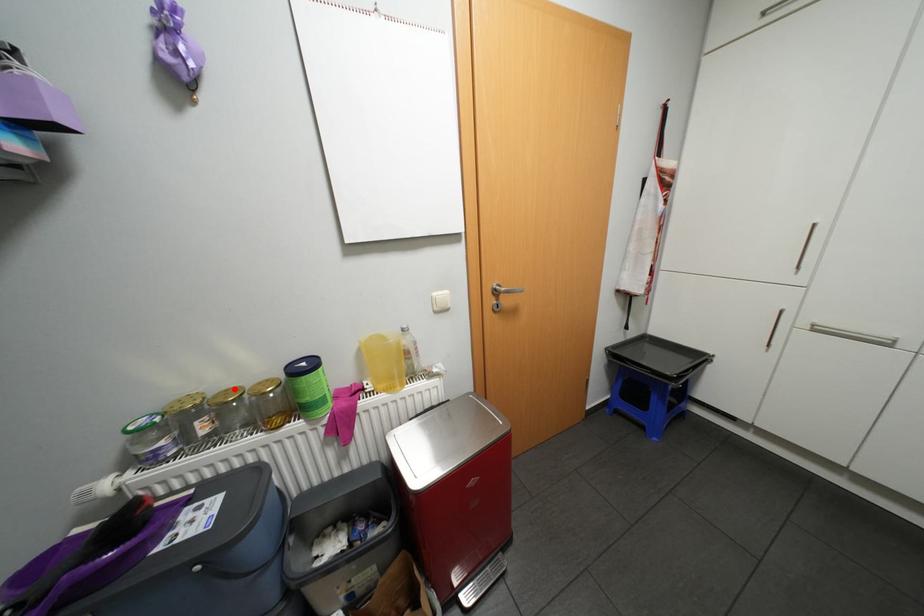
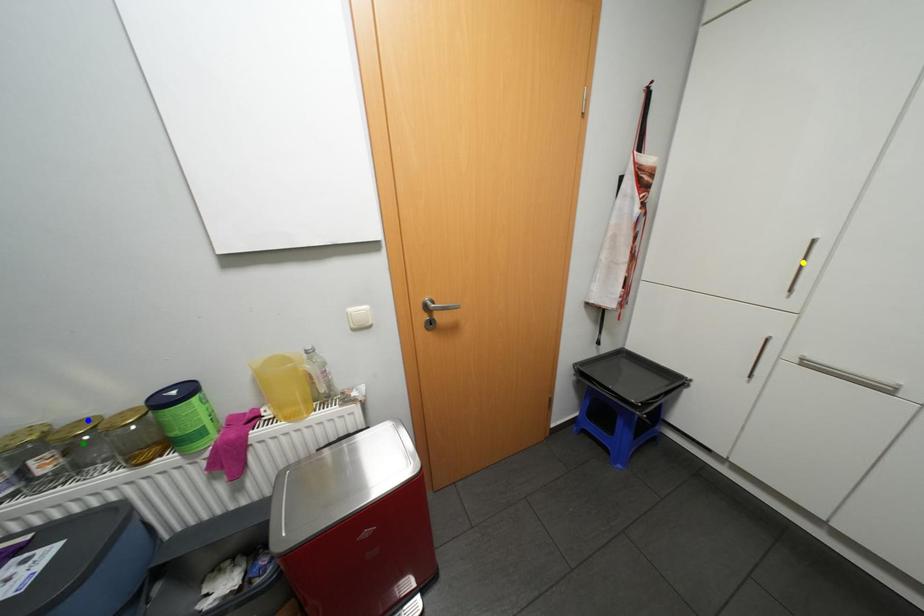
Question: I am providing you with two images of the same scene from different viewpoints. A red point is marked on the first image. You are given multiple points on the second image. Which point in image 2 is actually the same real-world point as the red point in image 1?

Choices:
 (A) blue point
 (B) green point
 (C) yellow point

Answer: (A)